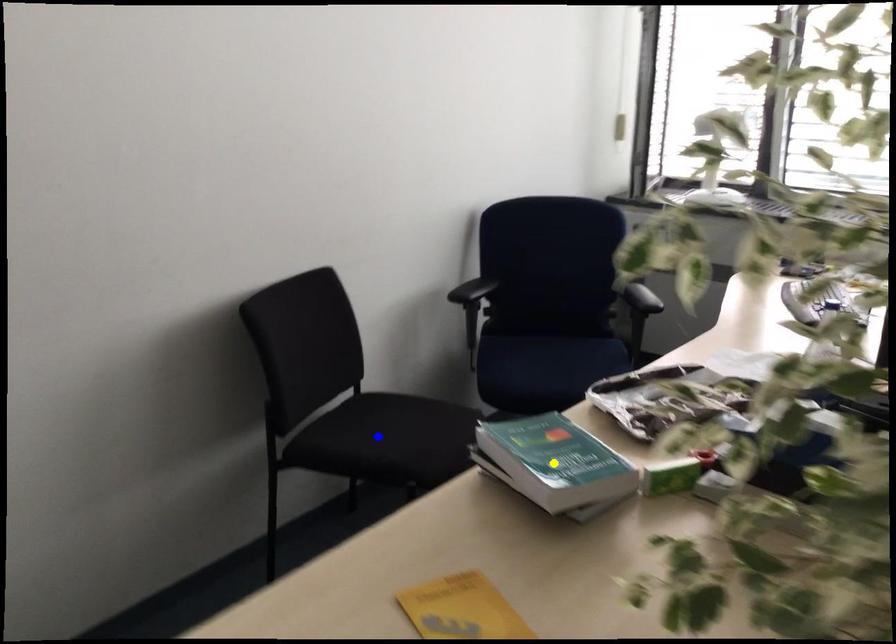
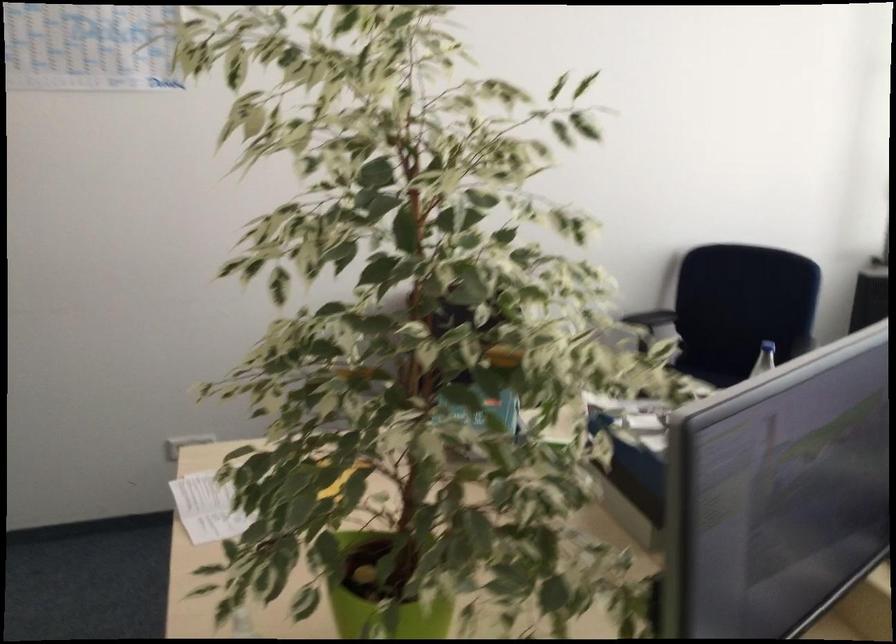
I am providing you with two images of the same scene from different viewpoints. Three points are marked in image1. Which point corresponds to a part or object that is occluded in image2?In image1, three points are marked. Which of them correspond to a part or object that is occluded in image2?Among the three points shown in image1, which one corresponds to a part or object that is no longer visible due to occlusion in image2?

Invisible in image2: blue point, green point, yellow point.